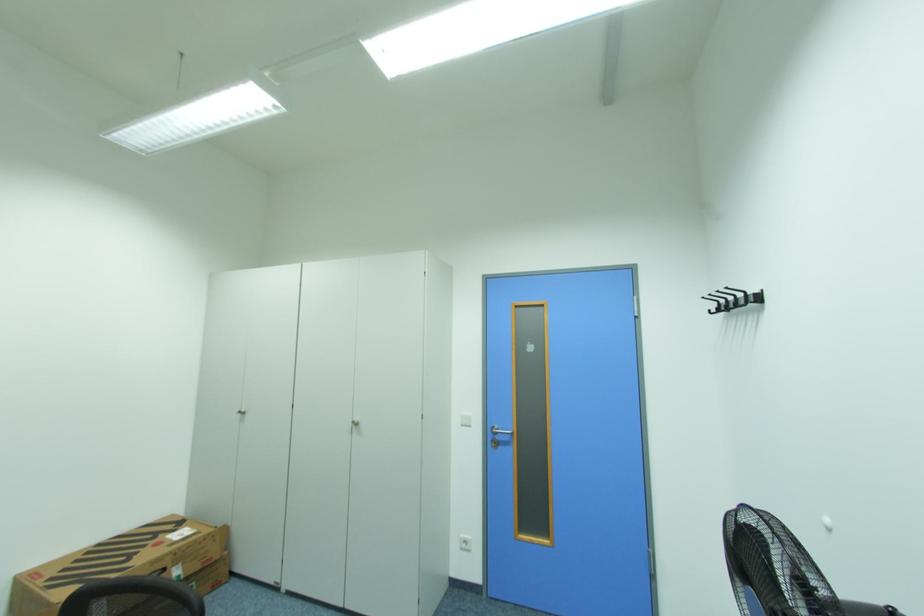
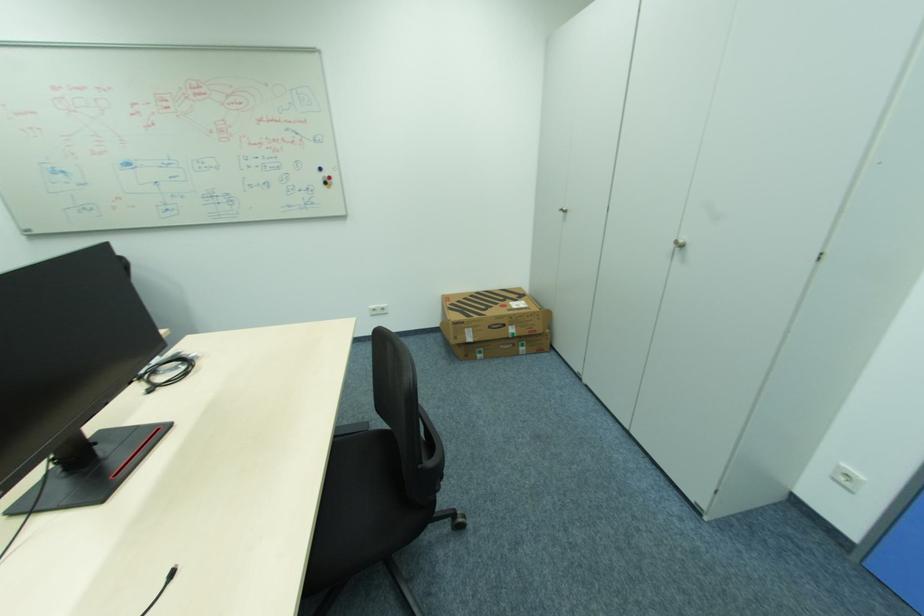
Locate, in the second image, the point that corresponds to point 166,535 in the first image.

(513, 300)